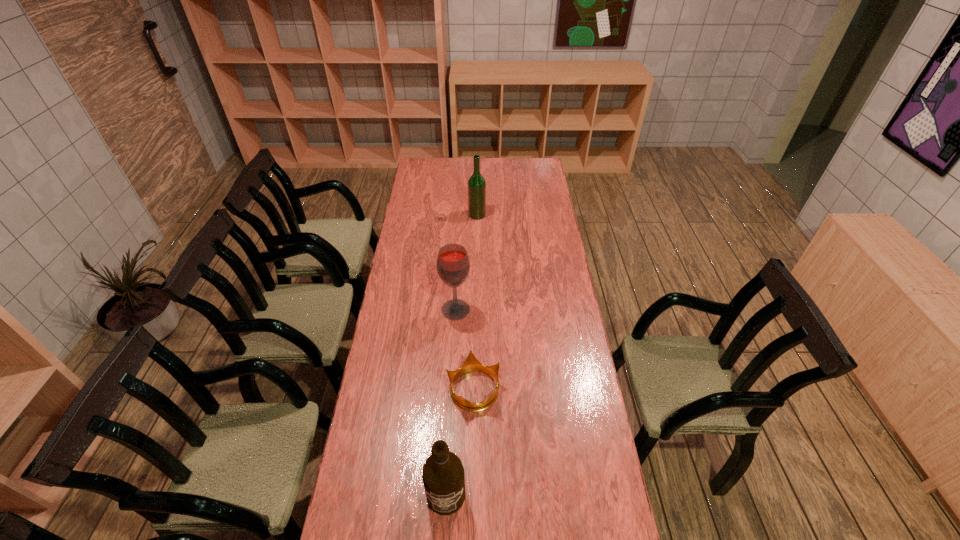
In the image, there is a desktop. Identify the location of vacant space at the left edge. The height and width of the screenshot is (540, 960). (423, 260).

In the image, there is a desktop. Where is `free space at the right edge`? The image size is (960, 540). free space at the right edge is located at coordinates (526, 226).

Locate an element on the screen. free spot between the farthest object and the third farthest object is located at coordinates (475, 302).

At what (x,y) coordinates should I click in order to perform the action: click on vacant space that is in between the crown and the third nearest object. Please return your answer as a coordinate pair (x, y). Looking at the image, I should click on (465, 349).

Locate an element on the screen. vacant area that lies between the nearest alcohol and the second farthest object is located at coordinates (451, 402).

Where is `vacant point located between the third farthest object and the third nearest object`? The width and height of the screenshot is (960, 540). vacant point located between the third farthest object and the third nearest object is located at coordinates (465, 349).

Locate an element on the screen. This screenshot has width=960, height=540. free point between the farthest alcohol and the third farthest object is located at coordinates (475, 302).

This screenshot has width=960, height=540. I want to click on vacant area that lies between the nearest alcohol and the farthest object, so click(462, 355).

At what (x,y) coordinates should I click in order to perform the action: click on unoccupied area between the nearest alcohol and the farthest alcohol. Please return your answer as a coordinate pair (x, y). The image size is (960, 540). Looking at the image, I should click on (462, 355).

The height and width of the screenshot is (540, 960). In order to click on free area in between the second nearest object and the farthest alcohol in this screenshot , I will do click(475, 302).